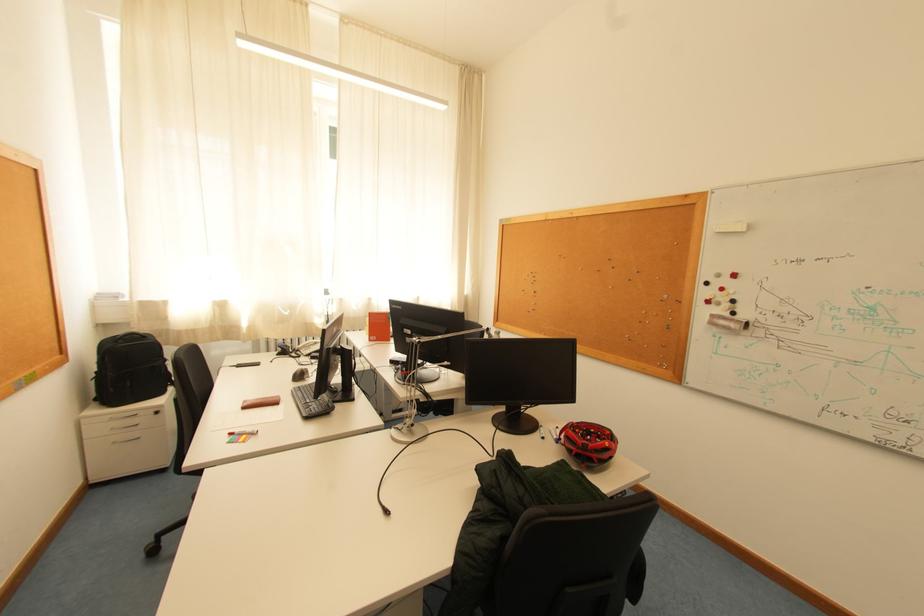
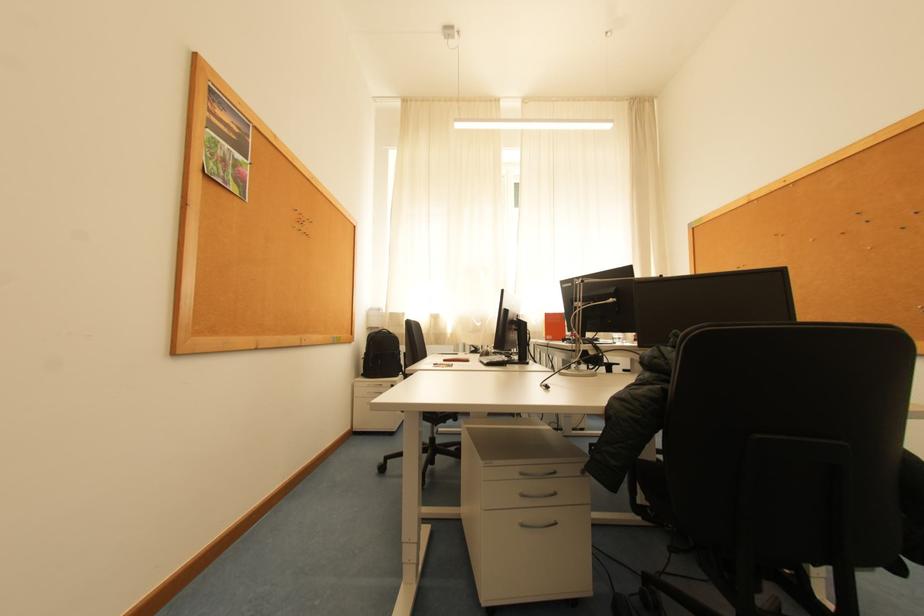
Question: The first image is from the beginning of the video and the second image is from the end. How did the camera likely rotate when shooting the video?

Choices:
 (A) Left
 (B) Right
 (C) Up
 (D) Down

Answer: (A)